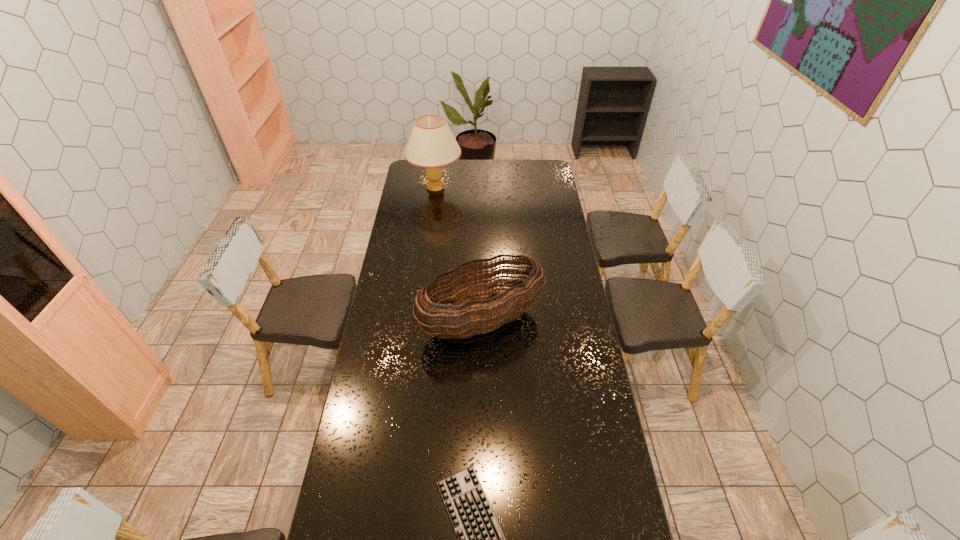
Image resolution: width=960 pixels, height=540 pixels. In the image, there is a desktop. Find the location of `vacant space at the left edge`. vacant space at the left edge is located at coordinates (353, 497).

This screenshot has width=960, height=540. I want to click on blank area at the right edge, so click(573, 367).

Find the location of a particular element. The height and width of the screenshot is (540, 960). free point between the second farthest object and the tallest object is located at coordinates (458, 254).

Locate an element on the screen. The width and height of the screenshot is (960, 540). free area in between the basket and the tallest object is located at coordinates (458, 254).

Locate an element on the screen. The image size is (960, 540). object that is the second closest to the second nearest object is located at coordinates (431, 144).

Identify the location of the closest object relative to the second nearest object. (480, 538).

Locate an element on the screen. This screenshot has width=960, height=540. vacant space that satisfies the following two spatial constraints: 1. on the front side of the second farthest object; 2. on the right side of the tallest object is located at coordinates (419, 321).

At what (x,y) coordinates should I click in order to perform the action: click on free point that satisfies the following two spatial constraints: 1. on the front side of the second tallest object; 2. on the right side of the tallest object. Please return your answer as a coordinate pair (x, y). Looking at the image, I should click on (419, 321).